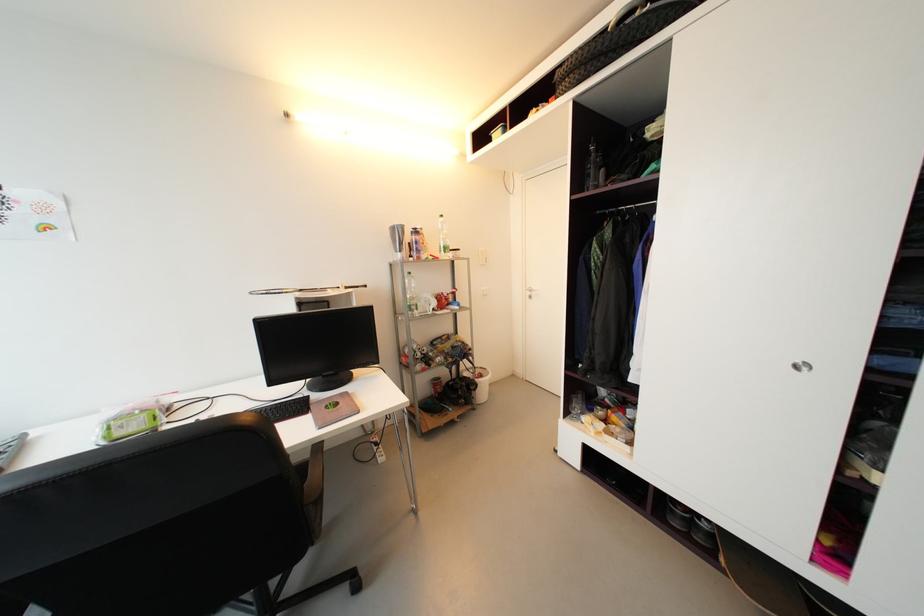
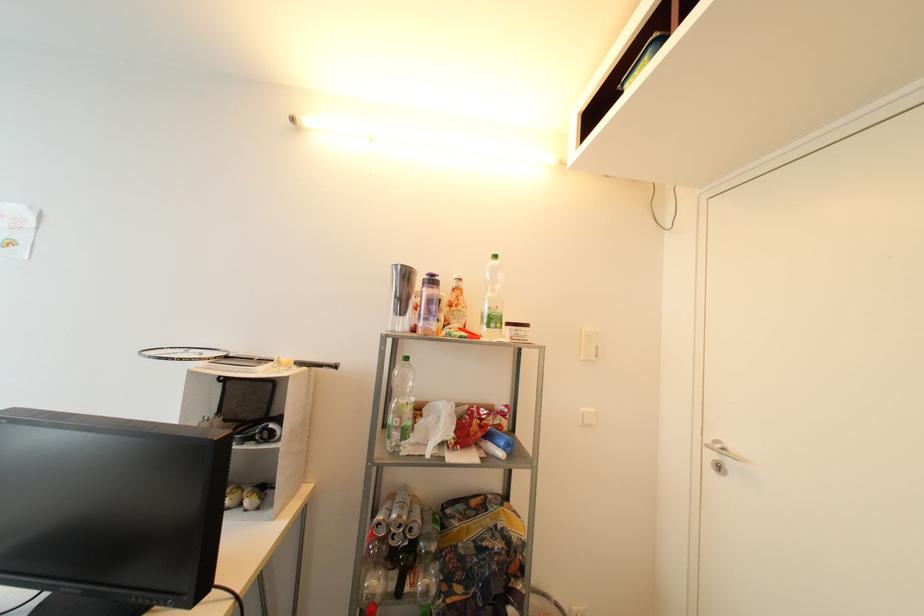
Locate, in the second image, the point that corresponds to pixel 451 251 in the first image.

(499, 322)